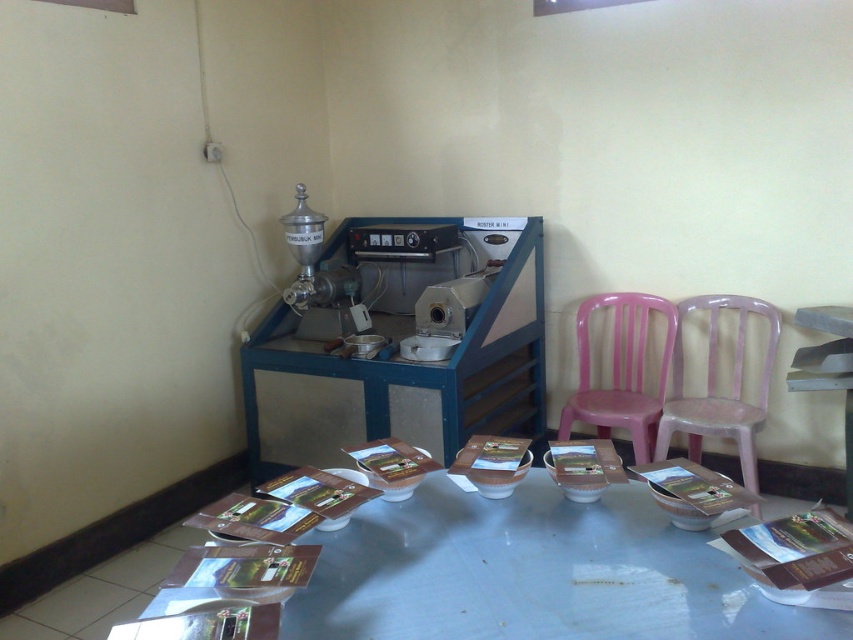
Does pink plastic chair at center come in front of pink plastic chair at right?

No, pink plastic chair at center is behind pink plastic chair at right.

Can you confirm if pink plastic chair at center is positioned above pink plastic chair at right?

Correct, pink plastic chair at center is located above pink plastic chair at right.

Image resolution: width=853 pixels, height=640 pixels. I want to click on pink plastic chair at center, so click(x=622, y=371).

Is point (544, 531) positioned in front of point (776, 316)?

That is True.

I want to click on white glossy table at center, so click(x=532, y=573).

Identify the location of white glossy table at center. Image resolution: width=853 pixels, height=640 pixels. (532, 573).

The height and width of the screenshot is (640, 853). Describe the element at coordinates (532, 573) in the screenshot. I see `white glossy table at center` at that location.

Who is higher up, white glossy table at center or pink plastic chair at center?

pink plastic chair at center is higher up.

Who is more distant from viewer, (386, 561) or (633, 388)?

The point (633, 388) is behind.

At what (x,y) coordinates should I click in order to perform the action: click on white glossy table at center. Please return your answer as a coordinate pair (x, y). The height and width of the screenshot is (640, 853). Looking at the image, I should click on (532, 573).